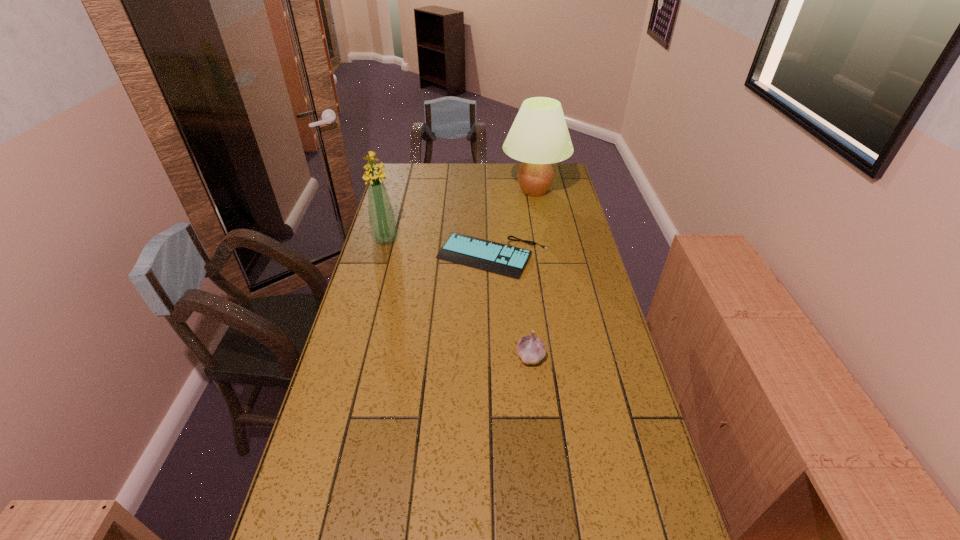
At what (x,y) coordinates should I click in order to perform the action: click on free region that satisfies the following two spatial constraints: 1. on the front side of the shortest object; 2. on the left side of the nearest object. Please return your answer as a coordinate pair (x, y). The width and height of the screenshot is (960, 540). Looking at the image, I should click on (495, 356).